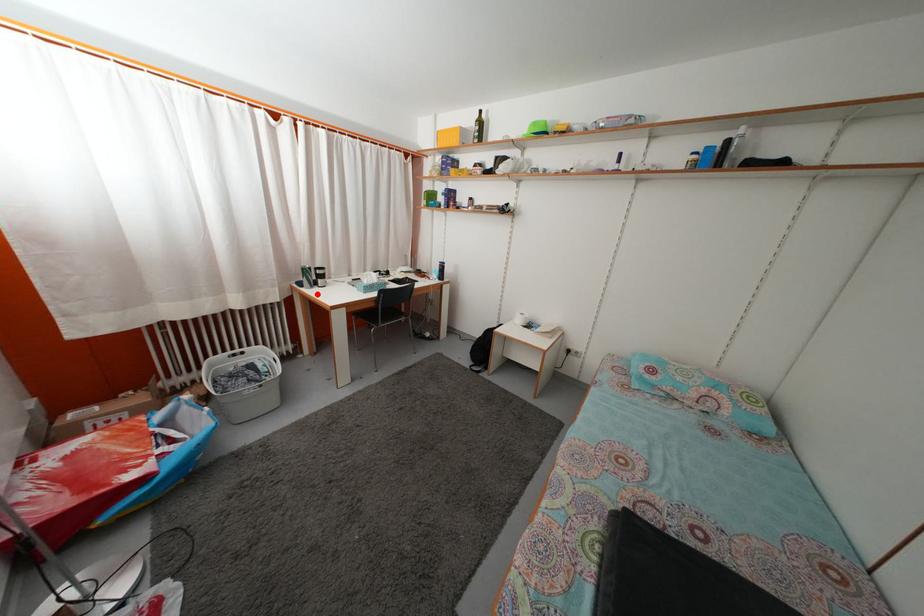
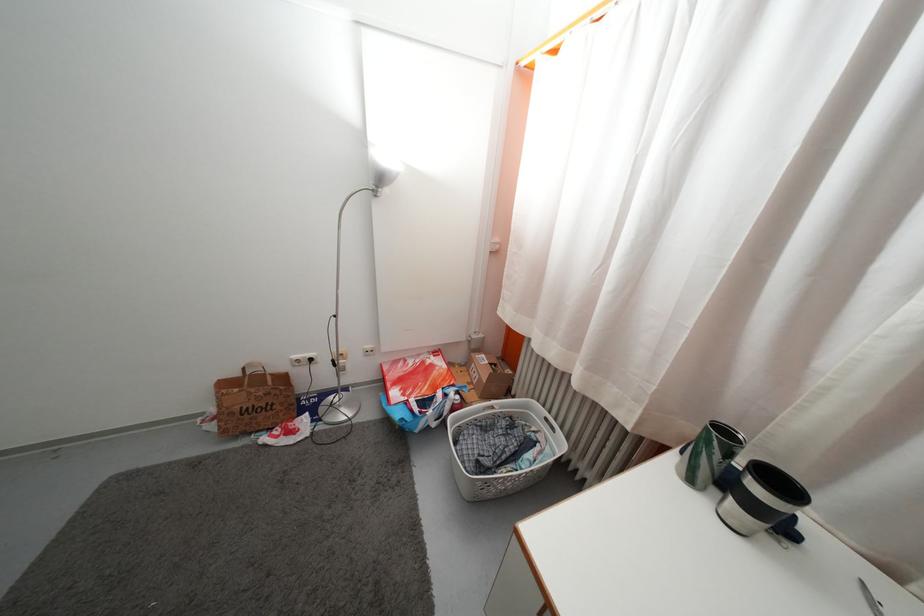
Question: I am providing you with two images of the same scene from different viewpoints. A red point is marked on the first image. Is the red point's position out of view in image 2?

Choices:
 (A) Yes
 (B) No

Answer: (B)